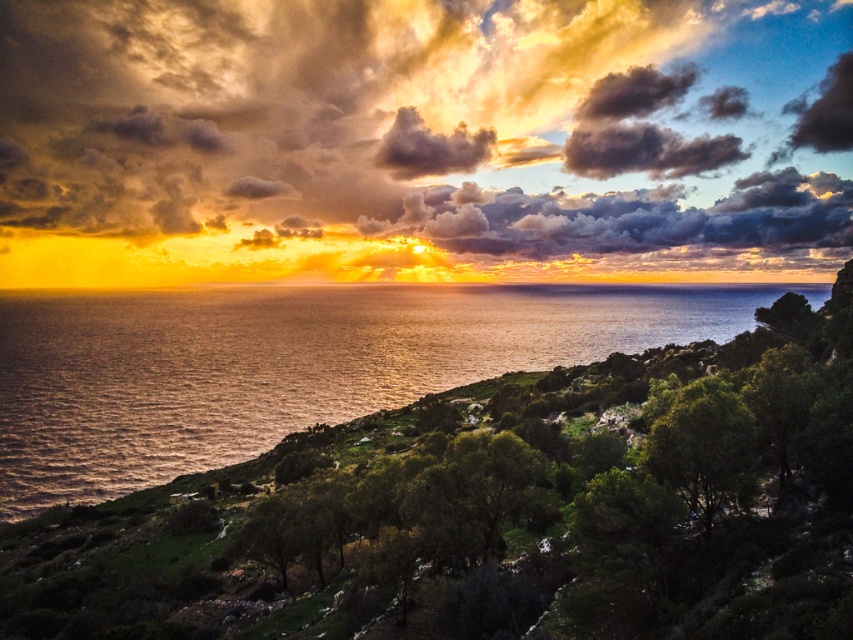
You are standing at the center of the image and want to locate the shiny metallic water at center. According to the coordinates provided, in which direction should you look to find it?

The shiny metallic water at center is located at coordinates point (289, 364). Since you are at the center, you should look slightly to the right and upwards to find it.